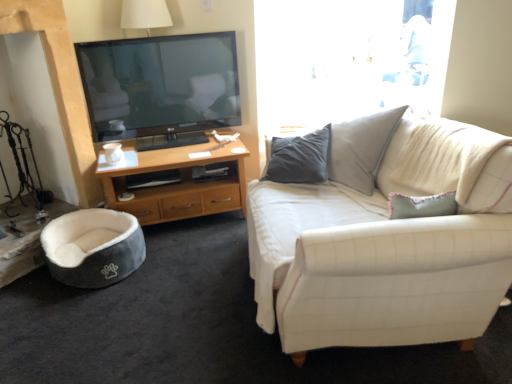
Where is `vacant space to the right of white matte coffee cup at lower left`? vacant space to the right of white matte coffee cup at lower left is located at coordinates (145, 158).